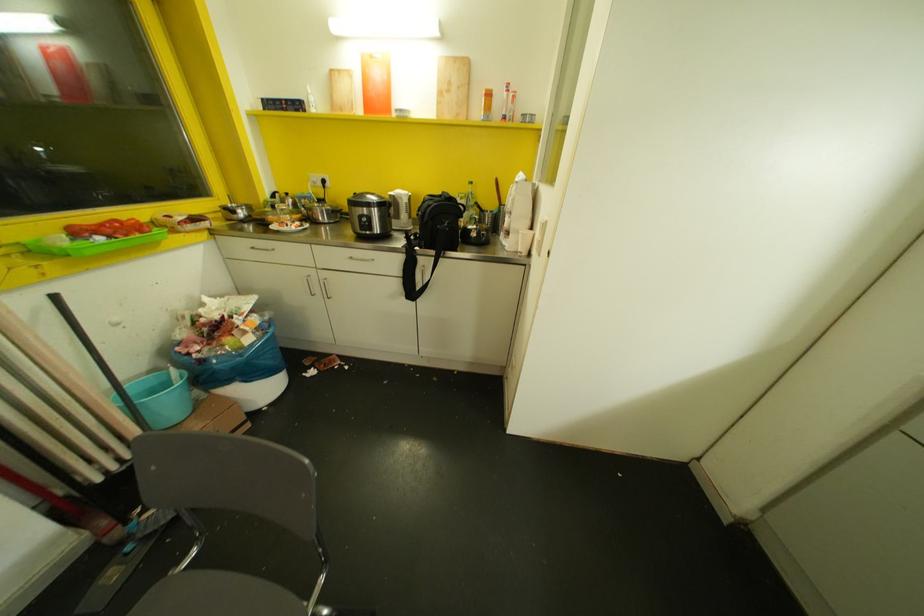
Where would you pull the white cabinet handle? Please return your answer as a coordinate pair (x, y).

(325, 284)